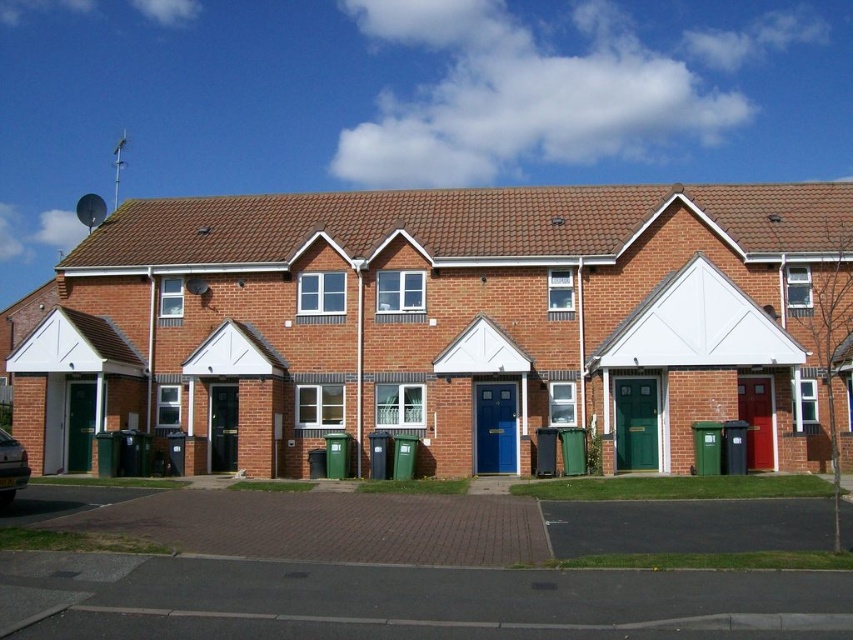
Does brick house at center appear on the right side of metallic silver car at lower left?

Yes, brick house at center is to the right of metallic silver car at lower left.

Can you confirm if brick house at center is positioned to the left of metallic silver car at lower left?

In fact, brick house at center is to the right of metallic silver car at lower left.

Where is `brick house at center`? The image size is (853, 640). brick house at center is located at coordinates (440, 323).